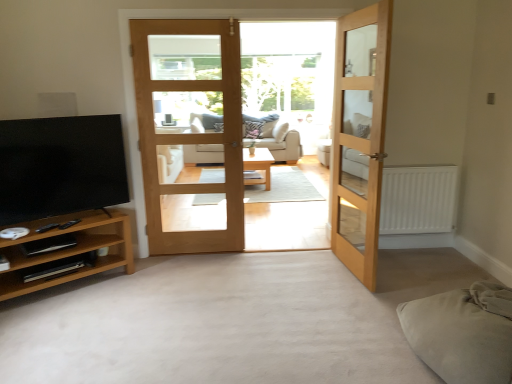
Question: Does light oak wooden door at center, marked as the 1th door in a left-to-right arrangement, have a larger size compared to beige fabric studio couch at center?

Choices:
 (A) yes
 (B) no

Answer: (B)

Question: Is light oak wooden door at center, marked as the 1th door in a left-to-right arrangement, further to camera compared to beige fabric studio couch at center?

Choices:
 (A) yes
 (B) no

Answer: (B)

Question: Can you confirm if light oak wooden door at center, the second door when ordered from right to left, is thinner than beige fabric studio couch at center?

Choices:
 (A) no
 (B) yes

Answer: (B)

Question: From the image's perspective, is light oak wooden door at center, marked as the 1th door in a left-to-right arrangement, on beige fabric studio couch at center?

Choices:
 (A) no
 (B) yes

Answer: (A)

Question: Is light oak wooden door at center, marked as the 1th door in a left-to-right arrangement, outside beige fabric studio couch at center?

Choices:
 (A) no
 (B) yes

Answer: (B)

Question: Is brown wood tv stand at lower left taller or shorter than beige fabric studio couch at center?

Choices:
 (A) tall
 (B) short

Answer: (B)

Question: From a real-world perspective, is brown wood tv stand at lower left above or below beige fabric studio couch at center?

Choices:
 (A) below
 (B) above

Answer: (A)

Question: Is brown wood tv stand at lower left in front of or behind beige fabric studio couch at center in the image?

Choices:
 (A) front
 (B) behind

Answer: (A)

Question: Considering the positions of brown wood tv stand at lower left and beige fabric studio couch at center in the image, is brown wood tv stand at lower left bigger or smaller than beige fabric studio couch at center?

Choices:
 (A) small
 (B) big

Answer: (A)

Question: From a real-world perspective, is clear glass door at center above or below matte black tv at left?

Choices:
 (A) below
 (B) above

Answer: (B)

Question: Looking at their shapes, would you say clear glass door at center is wider or thinner than matte black tv at left?

Choices:
 (A) wide
 (B) thin

Answer: (B)

Question: Which is correct: clear glass door at center is inside matte black tv at left, or outside of it?

Choices:
 (A) outside
 (B) inside

Answer: (A)

Question: Considering their positions, is clear glass door at center located in front of or behind matte black tv at left?

Choices:
 (A) behind
 (B) front

Answer: (A)

Question: Considering the relative positions of light wood/finished table at center and matte black tv at left in the image provided, is light wood/finished table at center to the left or to the right of matte black tv at left?

Choices:
 (A) left
 (B) right

Answer: (B)

Question: From a real-world perspective, is light wood/finished table at center physically located above or below matte black tv at left?

Choices:
 (A) below
 (B) above

Answer: (A)